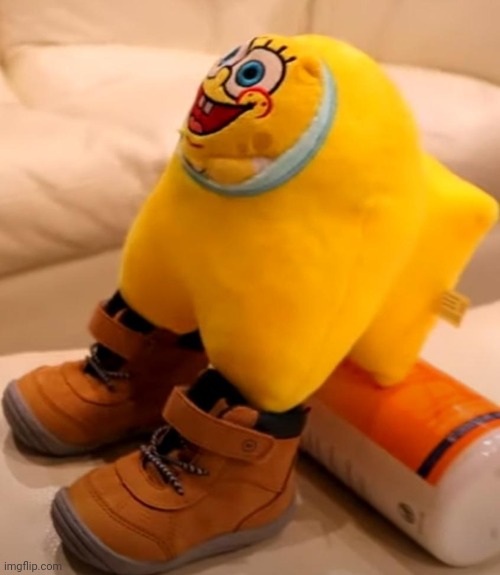
Identify the location of couch. Image resolution: width=500 pixels, height=575 pixels. (86, 181).